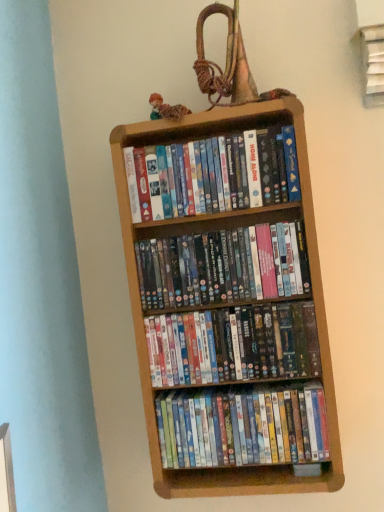
Question: Is multicolored fabric doll at upper center inside matte plastic dvds at center, which is counted as the 3th book, starting from the top?

Choices:
 (A) yes
 (B) no

Answer: (B)

Question: Does matte plastic dvds at center, which is counted as the 3th book, starting from the top, come behind multicolored fabric doll at upper center?

Choices:
 (A) yes
 (B) no

Answer: (B)

Question: Is matte plastic dvds at center, which is counted as the 3th book, starting from the top, taller than multicolored fabric doll at upper center?

Choices:
 (A) yes
 (B) no

Answer: (A)

Question: Does matte plastic dvds at center, positioned as the 2th book in bottom-to-top order, have a smaller size compared to multicolored fabric doll at upper center?

Choices:
 (A) yes
 (B) no

Answer: (B)

Question: Can you confirm if matte plastic dvds at center, positioned as the 2th book in bottom-to-top order, is wider than multicolored fabric doll at upper center?

Choices:
 (A) no
 (B) yes

Answer: (B)

Question: Is matte plastic dvds at upper center, the first book when ordered from top to bottom, at the back of matte plastic dvds at center, which is counted as the 3th book, starting from the top?

Choices:
 (A) yes
 (B) no

Answer: (B)

Question: From a real-world perspective, is matte plastic dvds at center, positioned as the 2th book in bottom-to-top order, under matte plastic dvds at upper center, the 4th book in the bottom-to-top sequence?

Choices:
 (A) yes
 (B) no

Answer: (A)

Question: Can matte plastic dvds at upper center, the 4th book in the bottom-to-top sequence, be found inside matte plastic dvds at center, which is counted as the 3th book, starting from the top?

Choices:
 (A) no
 (B) yes

Answer: (A)

Question: Does matte plastic dvds at center, which is counted as the 3th book, starting from the top, have a greater height compared to matte plastic dvds at upper center, the first book when ordered from top to bottom?

Choices:
 (A) yes
 (B) no

Answer: (B)

Question: Is matte plastic dvds at center, positioned as the 2th book in bottom-to-top order, at the left side of matte plastic dvds at upper center, the 4th book in the bottom-to-top sequence?

Choices:
 (A) yes
 (B) no

Answer: (B)

Question: Is matte plastic dvds at center, positioned as the 2th book in bottom-to-top order, smaller than matte plastic dvds at upper center, the first book when ordered from top to bottom?

Choices:
 (A) no
 (B) yes

Answer: (B)

Question: From a real-world perspective, is multicolored plastic dvds at center, which is counted as the 2th book, starting from the top, located beneath multicolored fabric doll at upper center?

Choices:
 (A) yes
 (B) no

Answer: (A)